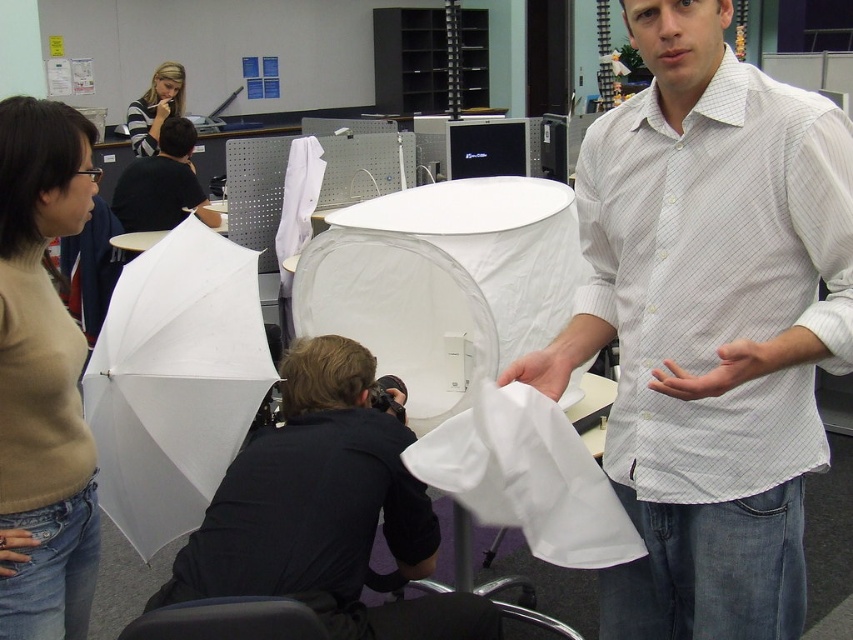
Question: Which point is closer to the camera taking this photo?

Choices:
 (A) (172, 65)
 (B) (177, 320)
 (C) (3, 168)

Answer: (C)

Question: Among these points, which one is farthest from the camera?

Choices:
 (A) (38, 289)
 (B) (154, 99)
 (C) (178, 365)

Answer: (B)

Question: Does beige sweater at center lie in front of matte black shirt at upper left?

Choices:
 (A) yes
 (B) no

Answer: (A)

Question: Which object is the farthest from the beige sweater at center?

Choices:
 (A) matte black shirt at upper left
 (B) white matte umbrella at left
 (C) black shirt at upper left

Answer: (A)

Question: Can you confirm if beige sweater at center is wider than black shirt at upper left?

Choices:
 (A) no
 (B) yes

Answer: (A)

Question: Is beige sweater at center above white matte umbrella at left?

Choices:
 (A) no
 (B) yes

Answer: (A)